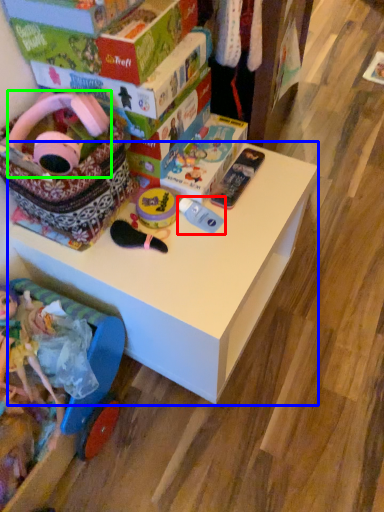
Question: Estimate the real-world distances between objects in this image. Which object is closer to toy (highlighted by a red box), table (highlighted by a blue box) or toy (highlighted by a green box)?

Choices:
 (A) table
 (B) toy

Answer: (A)